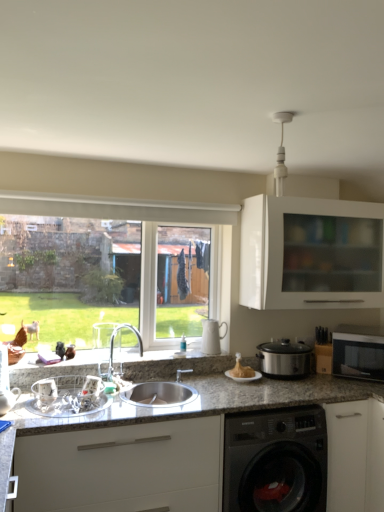
Measure the distance between granite countertop at lower left, which ranks as the second cabinetry in top-to-bottom order, and camera.

granite countertop at lower left, which ranks as the second cabinetry in top-to-bottom order, is 6.21 feet away from camera.

This screenshot has width=384, height=512. Describe the element at coordinates (212, 336) in the screenshot. I see `white ceramic teapot at center` at that location.

This screenshot has height=512, width=384. In order to click on silver metallic microwave at right in this screenshot , I will do `click(358, 352)`.

The height and width of the screenshot is (512, 384). I want to click on granite/stone countertop at lower center, so click(x=189, y=450).

From a real-world perspective, is white glossy cabinet at upper right, the 1th cabinetry from the back, positioned over metallic silver dish rack at sink, positioned as the 1th appliance in front-to-back order, based on gravity?

Indeed, from a real-world perspective, white glossy cabinet at upper right, the 1th cabinetry from the back, stands above metallic silver dish rack at sink, positioned as the 1th appliance in front-to-back order.

Is white glossy cabinet at upper right, placed as the second cabinetry when sorted from left to right, next to metallic silver dish rack at sink, positioned as the 1th appliance in front-to-back order, and touching it?

No, white glossy cabinet at upper right, placed as the second cabinetry when sorted from left to right, is not next to metallic silver dish rack at sink, positioned as the 1th appliance in front-to-back order.

From the image's perspective, is white glossy cabinet at upper right, marked as the 1th cabinetry in a top-to-bottom arrangement, located above metallic silver dish rack at sink, arranged as the second appliance when viewed from the right?

Correct, white glossy cabinet at upper right, marked as the 1th cabinetry in a top-to-bottom arrangement, appears higher than metallic silver dish rack at sink, arranged as the second appliance when viewed from the right, in the image.

Which of these two, white ceramic teapot at center or golden crispy turkey at center, is smaller?

golden crispy turkey at center.

Which object is thinner, white ceramic teapot at center or golden crispy turkey at center?

white ceramic teapot at center is thinner.

From the image's perspective, which one is positioned higher, white ceramic teapot at center or golden crispy turkey at center?

white ceramic teapot at center is shown above in the image.

Which is nearer, (216, 337) or (235, 374)?

Clearly, point (216, 337) is more distant from the camera than point (235, 374).

From the image's perspective, who appears lower, satin silver slow cooker at right, placed as the third appliance when sorted from front to back, or metallic silver sink at lower left, the 1th appliance viewed from the left?

satin silver slow cooker at right, placed as the third appliance when sorted from front to back, is shown below in the image.

Is satin silver slow cooker at right, the 3th appliance in the left-to-right sequence, to the right of metallic silver sink at lower left, which ranks as the 3th appliance in right-to-left order, from the viewer's perspective?

Yes, satin silver slow cooker at right, the 3th appliance in the left-to-right sequence, is to the right of metallic silver sink at lower left, which ranks as the 3th appliance in right-to-left order.

From a real-world perspective, which object stands above the other?

From a 3D spatial view, metallic silver sink at lower left, the 2th appliance in the front-to-back sequence, is above.

Starting from the satin silver slow cooker at right, marked as the first appliance in a back-to-front arrangement, which appliance is the 2nd one to the left? Please provide its 2D coordinates.

[(6, 384)]

Can you tell me how much white glossy cabinet at upper right, marked as the 1th cabinetry in a top-to-bottom arrangement, and golden crispy turkey at center differ in facing direction?

The angle between the facing direction of white glossy cabinet at upper right, marked as the 1th cabinetry in a top-to-bottom arrangement, and the facing direction of golden crispy turkey at center is 0.252 degrees.

Is white glossy cabinet at upper right, acting as the second cabinetry starting from the bottom, oriented towards golden crispy turkey at center?

No, white glossy cabinet at upper right, acting as the second cabinetry starting from the bottom, is not aimed at golden crispy turkey at center.

Can golden crispy turkey at center be found inside white glossy cabinet at upper right, marked as the 1th cabinetry in a top-to-bottom arrangement?

No, golden crispy turkey at center is located outside of white glossy cabinet at upper right, marked as the 1th cabinetry in a top-to-bottom arrangement.

Is golden crispy turkey at center spatially inside granite/stone countertop at lower center, or outside of it?

golden crispy turkey at center is spatially situated outside granite/stone countertop at lower center.

Based on the photo, does golden crispy turkey at center have a greater width compared to granite/stone countertop at lower center?

No, golden crispy turkey at center is not wider than granite/stone countertop at lower center.

Is golden crispy turkey at center positioned before granite/stone countertop at lower center?

No, golden crispy turkey at center is behind granite/stone countertop at lower center.

From the image's perspective, would you say golden crispy turkey at center is positioned over granite/stone countertop at lower center?

Yes, from the image's perspective, golden crispy turkey at center is over granite/stone countertop at lower center.

Is metallic silver sink at lower left, which ranks as the 3th appliance in right-to-left order, wider or thinner than clear glass window at center?

In the image, metallic silver sink at lower left, which ranks as the 3th appliance in right-to-left order, appears to be more narrow than clear glass window at center.

Which object is further away from the camera taking this photo, metallic silver sink at lower left, which ranks as the 3th appliance in right-to-left order, or clear glass window at center?

clear glass window at center.

Can you confirm if metallic silver sink at lower left, the 2th appliance from the back, is shorter than clear glass window at center?

Indeed, metallic silver sink at lower left, the 2th appliance from the back, has a lesser height compared to clear glass window at center.

Is metallic silver sink at lower left, the 2th appliance from the back, shorter than silver metallic faucet at center?

Indeed, metallic silver sink at lower left, the 2th appliance from the back, has a lesser height compared to silver metallic faucet at center.

Would you say silver metallic faucet at center is part of metallic silver sink at lower left, the 2th appliance in the front-to-back sequence,'s contents?

No, silver metallic faucet at center is located outside of metallic silver sink at lower left, the 2th appliance in the front-to-back sequence.

Between metallic silver sink at lower left, the 2th appliance in the front-to-back sequence, and silver metallic faucet at center, which one has larger width?

With larger width is silver metallic faucet at center.

From the image's perspective, is metallic silver sink at lower left, which ranks as the 3th appliance in right-to-left order, located above silver metallic faucet at center?

Yes, from the image's perspective, metallic silver sink at lower left, which ranks as the 3th appliance in right-to-left order, is over silver metallic faucet at center.

Find the location of `cabinetry behind the metallic silver dish rack at sink, positioned as the 1th appliance in front-to-back order`. cabinetry behind the metallic silver dish rack at sink, positioned as the 1th appliance in front-to-back order is located at coordinates (308, 256).

At what (x,y) coordinates should I click in order to perform the action: click on food on the right of white ceramic teapot at center. Please return your answer as a coordinate pair (x, y). Looking at the image, I should click on (241, 370).

When comparing their distances from silver metallic microwave at right, does white glossy cabinet at upper right, which is the second cabinetry from front to back, or metallic silver dish rack at sink, the 3th appliance in the back-to-front sequence, seem closer?

white glossy cabinet at upper right, which is the second cabinetry from front to back, lies closer to silver metallic microwave at right than the other object.

Estimate the real-world distances between objects in this image. Which object is closer to metallic silver dish rack at sink, arranged as the second appliance when viewed from the right, golden crispy turkey at center or metallic silver sink at lower left, which ranks as the 3th appliance in right-to-left order?

Among the two, metallic silver sink at lower left, which ranks as the 3th appliance in right-to-left order, is located nearer to metallic silver dish rack at sink, arranged as the second appliance when viewed from the right.

Based on their spatial positions, is metallic silver dish rack at sink, the 3th appliance in the back-to-front sequence, or golden crispy turkey at center closer to satin silver slow cooker at right, placed as the 1th appliance when sorted from right to left?

Based on the image, golden crispy turkey at center appears to be nearer to satin silver slow cooker at right, placed as the 1th appliance when sorted from right to left.

Estimate the real-world distances between objects in this image. Which object is closer to clear glass window at center, metallic silver sink at lower left, the 2th appliance in the front-to-back sequence, or granite countertop at lower left, which ranks as the second cabinetry in top-to-bottom order?

metallic silver sink at lower left, the 2th appliance in the front-to-back sequence, is positioned closer to the anchor clear glass window at center.

Which object lies nearer to the anchor point silver metallic faucet at center, silver metallic microwave at right or metallic silver dish rack at sink, which is counted as the second appliance, starting from the left?

metallic silver dish rack at sink, which is counted as the second appliance, starting from the left, is positioned closer to the anchor silver metallic faucet at center.

Looking at the image, which one is located closer to satin silver slow cooker at right, the 3th appliance in the left-to-right sequence, metallic silver dish rack at sink, the 3th appliance in the back-to-front sequence, or white ceramic teapot at center?

white ceramic teapot at center.

From the picture: Which object lies further to the anchor point white ceramic teapot at center, white glossy cabinet at upper right, the first cabinetry in the right-to-left sequence, or granite countertop at lower left, positioned as the first cabinetry in left-to-right order?

The object further to white ceramic teapot at center is granite countertop at lower left, positioned as the first cabinetry in left-to-right order.

Looking at the image, which one is located closer to silver metallic microwave at right, granite/stone countertop at lower center or granite countertop at lower left, positioned as the first cabinetry in left-to-right order?

The object closer to silver metallic microwave at right is granite/stone countertop at lower center.

The image size is (384, 512). I want to click on tea pot between silver metallic faucet at center and satin silver slow cooker at right, placed as the third appliance when sorted from front to back, in the horizontal direction, so click(212, 336).

Find the location of a particular element. The height and width of the screenshot is (512, 384). appliance between metallic silver dish rack at sink, which is counted as the second appliance, starting from the left, and white glossy cabinet at upper right, the 1th cabinetry from the back, from left to right is located at coordinates (284, 358).

Locate an element on the screen. Image resolution: width=384 pixels, height=512 pixels. food located between silver metallic faucet at center and silver metallic microwave at right in the left-right direction is located at coordinates (241, 370).

You are a GUI agent. You are given a task and a screenshot of the screen. Output one action in this format:
    pyautogui.click(x=<x>, y=<y>)
    Task: Click on the tea pot situated between metallic silver sink at lower left, the 1th appliance viewed from the left, and satin silver slow cooker at right, the 3th appliance in the left-to-right sequence, from left to right
    This screenshot has height=512, width=384.
    Given the screenshot: What is the action you would take?
    pos(212,336)